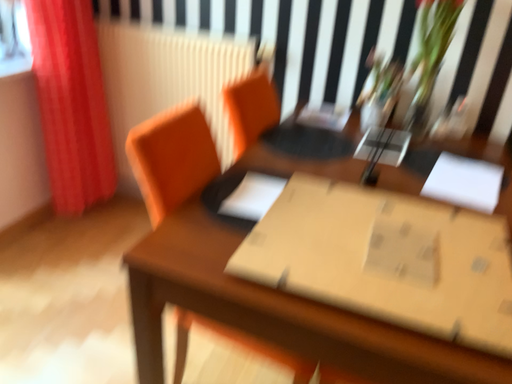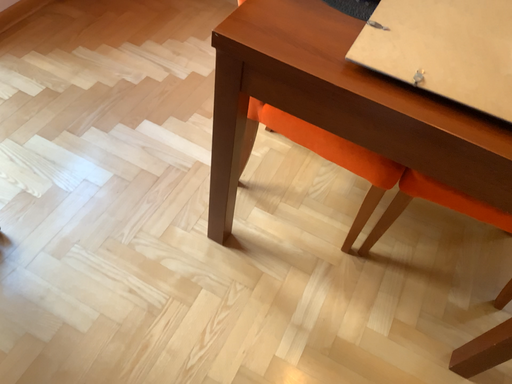
Question: How did the camera likely rotate when shooting the video?

Choices:
 (A) rotated upward
 (B) rotated downward

Answer: (B)